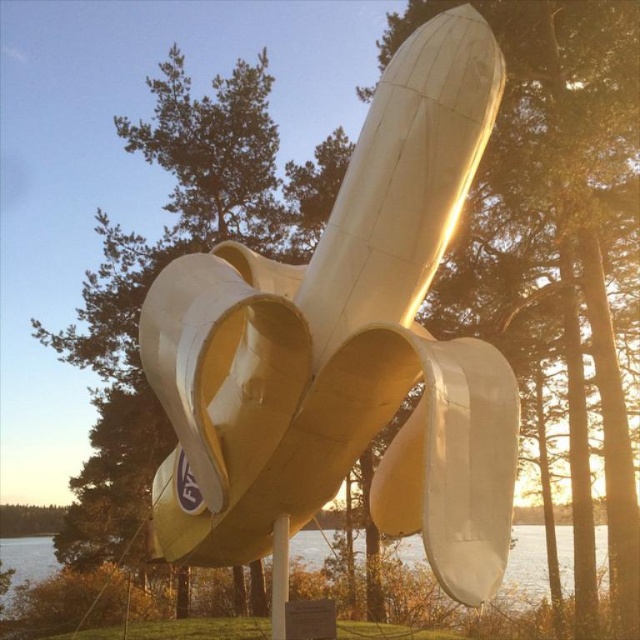
You are a photographer planning to capture the matte white sculpture at upper center and the green leafy tree at center in a single shot. Based on their shapes, which object would appear narrower in the photo?

The matte white sculpture at upper center is thinner than the green leafy tree at center, so it would appear narrower in the photo.